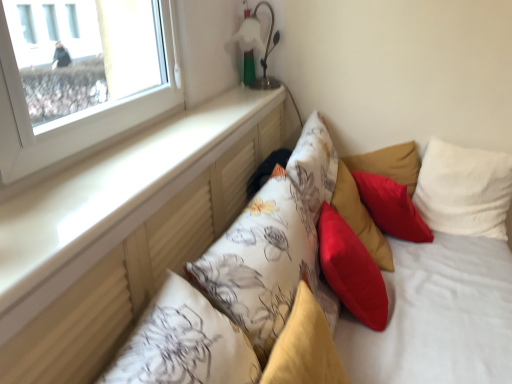
Question: From a real-world perspective, is fluffy yellow pillow at center, the second pillow from the left, physically below metallic silver table lamp at upper center?

Choices:
 (A) yes
 (B) no

Answer: (A)

Question: Considering the relative sizes of fluffy yellow pillow at center, the second pillow from the left, and metallic silver table lamp at upper center in the image provided, is fluffy yellow pillow at center, the second pillow from the left, wider than metallic silver table lamp at upper center?

Choices:
 (A) yes
 (B) no

Answer: (B)

Question: Considering the relative sizes of fluffy yellow pillow at center, the second pillow from the left, and metallic silver table lamp at upper center in the image provided, is fluffy yellow pillow at center, the second pillow from the left, smaller than metallic silver table lamp at upper center?

Choices:
 (A) yes
 (B) no

Answer: (B)

Question: Can you confirm if fluffy yellow pillow at center, which is counted as the 5th pillow, starting from the right, is thinner than metallic silver table lamp at upper center?

Choices:
 (A) no
 (B) yes

Answer: (B)

Question: Considering the relative sizes of fluffy yellow pillow at center, which is counted as the 5th pillow, starting from the right, and metallic silver table lamp at upper center in the image provided, is fluffy yellow pillow at center, which is counted as the 5th pillow, starting from the right, shorter than metallic silver table lamp at upper center?

Choices:
 (A) no
 (B) yes

Answer: (A)

Question: Looking at the image, does silky red cushion at center, the fourth pillow when ordered from left to right, seem bigger or smaller compared to white matte window sill at upper left?

Choices:
 (A) big
 (B) small

Answer: (A)

Question: Considering the positions of silky red cushion at center, the fourth pillow when ordered from left to right, and white matte window sill at upper left in the image, is silky red cushion at center, the fourth pillow when ordered from left to right, taller or shorter than white matte window sill at upper left?

Choices:
 (A) tall
 (B) short

Answer: (A)

Question: Choose the correct answer: Is silky red cushion at center, which is the 3th pillow from right to left, inside white matte window sill at upper left or outside it?

Choices:
 (A) outside
 (B) inside

Answer: (A)

Question: Relative to white matte window sill at upper left, is silky red cushion at center, the fourth pillow when ordered from left to right, in front or behind?

Choices:
 (A) front
 (B) behind

Answer: (B)

Question: From the image's perspective, is white matte window sill at upper left above or below red matte pillow at upper right, the second pillow from the right?

Choices:
 (A) below
 (B) above

Answer: (B)

Question: Based on their positions, is white matte window sill at upper left located to the left or right of red matte pillow at upper right, which is the fifth pillow from left to right?

Choices:
 (A) left
 (B) right

Answer: (A)

Question: In terms of size, does white matte window sill at upper left appear bigger or smaller than red matte pillow at upper right, which is the fifth pillow from left to right?

Choices:
 (A) small
 (B) big

Answer: (B)

Question: Considering the positions of white matte window sill at upper left and red matte pillow at upper right, the second pillow from the right, in the image, is white matte window sill at upper left wider or thinner than red matte pillow at upper right, the second pillow from the right,?

Choices:
 (A) wide
 (B) thin

Answer: (A)

Question: Considering the positions of fluffy yellow pillow at center, which is counted as the 5th pillow, starting from the right, and floral fabric pillow at center, which is the 6th pillow in right-to-left order, in the image, is fluffy yellow pillow at center, which is counted as the 5th pillow, starting from the right, wider or thinner than floral fabric pillow at center, which is the 6th pillow in right-to-left order,?

Choices:
 (A) wide
 (B) thin

Answer: (B)

Question: Do you think fluffy yellow pillow at center, the second pillow from the left, is within floral fabric pillow at center, which is the 6th pillow in right-to-left order, or outside of it?

Choices:
 (A) inside
 (B) outside

Answer: (A)